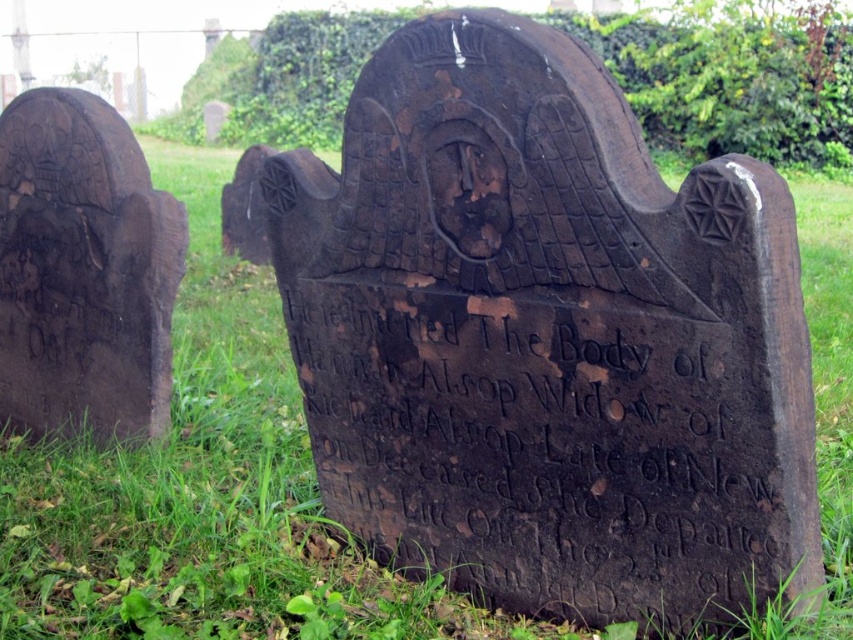
Question: Which point is farther to the camera?

Choices:
 (A) black stone inscription at center
 (B) dark brown wood at left

Answer: (B)

Question: Is black stone inscription at center behind dark brown wood at left?

Choices:
 (A) no
 (B) yes

Answer: (A)

Question: Does black stone inscription at center have a smaller size compared to dark brown wood at left?

Choices:
 (A) yes
 (B) no

Answer: (B)

Question: Among these objects, which one is nearest to the camera?

Choices:
 (A) dark brown wood at left
 (B) black stone inscription at center

Answer: (B)

Question: Is black stone inscription at center to the right of dark brown wood at left from the viewer's perspective?

Choices:
 (A) no
 (B) yes

Answer: (B)

Question: Among these objects, which one is nearest to the camera?

Choices:
 (A) dark brown wood at left
 (B) black stone inscription at center

Answer: (B)